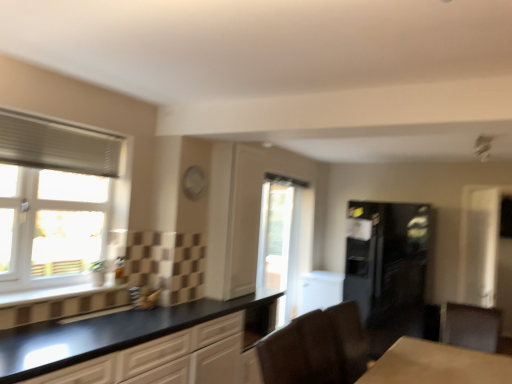
Image resolution: width=512 pixels, height=384 pixels. What do you see at coordinates (479, 244) in the screenshot?
I see `white glossy screen door at right` at bounding box center [479, 244].

You are a GUI agent. You are given a task and a screenshot of the screen. Output one action in this format:
    pyautogui.click(x=<x>, y=<y>)
    Task: Click on the matte black cabinet at lower right, which ranks as the 1th cabinetry in right-to-left order
    This screenshot has width=512, height=384.
    Given the screenshot: What is the action you would take?
    pyautogui.click(x=470, y=326)

Locate an element on the screen. The width and height of the screenshot is (512, 384). transparent glass door at center, which is the 2th window in front-to-back order is located at coordinates (284, 240).

You are a GUI agent. You are given a task and a screenshot of the screen. Output one action in this format:
    pyautogui.click(x=<x>, y=<y>)
    Task: Click on the brown leather armchair at lower center
    Image resolution: width=512 pixels, height=384 pixels.
    Given the screenshot: What is the action you would take?
    pyautogui.click(x=302, y=352)

The image size is (512, 384). In order to click on white glossy screen door at right in this screenshot , I will do `click(479, 244)`.

From the image's perspective, is black matte cabinet at lower left, which is the second cabinetry from right to left, beneath white glossy screen door at right?

Yes.

Are black matte cabinet at lower left, which is the second cabinetry from right to left, and white glossy screen door at right located far from each other?

Yes.

Could you tell me if black matte cabinet at lower left, arranged as the 1th cabinetry when viewed from the left, is turned towards white glossy screen door at right?

No, black matte cabinet at lower left, arranged as the 1th cabinetry when viewed from the left, does not turn towards white glossy screen door at right.

Measure the distance from black matte cabinet at lower left, arranged as the 1th cabinetry when viewed from the left, to white glossy screen door at right.

black matte cabinet at lower left, arranged as the 1th cabinetry when viewed from the left, is 10.02 feet away from white glossy screen door at right.

From a real-world perspective, who is located higher, transparent glass door at center, which is the 2th window in front-to-back order, or white pleated blind at upper left?

From a 3D spatial view, white pleated blind at upper left is above.

Between transparent glass door at center, acting as the 2th window starting from the left, and white pleated blind at upper left, which one has larger size?

transparent glass door at center, acting as the 2th window starting from the left, is bigger.

Is there a large distance between transparent glass door at center, the first window viewed from the right, and white pleated blind at upper left?

transparent glass door at center, the first window viewed from the right, is far away from white pleated blind at upper left.

Which is correct: transparent glass door at center, which appears as the first window when viewed from the back, is inside white pleated blind at upper left, or outside of it?

transparent glass door at center, which appears as the first window when viewed from the back, is outside white pleated blind at upper left.

From the image's perspective, which one is positioned lower, matte black cabinet at lower right, which appears as the second cabinetry when viewed from the left, or white pleated blind at upper left?

matte black cabinet at lower right, which appears as the second cabinetry when viewed from the left, is shown below in the image.

Can you confirm if matte black cabinet at lower right, which appears as the second cabinetry when viewed from the left, is smaller than white pleated blind at upper left?

Incorrect, matte black cabinet at lower right, which appears as the second cabinetry when viewed from the left, is not smaller in size than white pleated blind at upper left.

Choose the correct answer: Is matte black cabinet at lower right, which appears as the second cabinetry when viewed from the left, inside white pleated blind at upper left or outside it?

matte black cabinet at lower right, which appears as the second cabinetry when viewed from the left, is not inside white pleated blind at upper left, it's outside.

Can you confirm if matte black cabinet at lower right, which ranks as the 1th cabinetry in right-to-left order, is wider than white pleated blind at upper left?

Yes, matte black cabinet at lower right, which ranks as the 1th cabinetry in right-to-left order, is wider than white pleated blind at upper left.

The height and width of the screenshot is (384, 512). Identify the location of blind in front of the matte black cabinet at lower right, which appears as the second cabinetry when viewed from the left. (57, 146).

From the image's perspective, does white pleated blind at upper left appear lower than matte black cabinet at lower right, which ranks as the 1th cabinetry in right-to-left order?

No.

Considering the sizes of objects white pleated blind at upper left and matte black cabinet at lower right, which ranks as the 1th cabinetry in right-to-left order, in the image provided, who is wider, white pleated blind at upper left or matte black cabinet at lower right, which ranks as the 1th cabinetry in right-to-left order,?

Wider between the two is matte black cabinet at lower right, which ranks as the 1th cabinetry in right-to-left order.

Is white pleated blind at upper left aimed at matte black cabinet at lower right, which ranks as the 1th cabinetry in right-to-left order?

No, white pleated blind at upper left is not aimed at matte black cabinet at lower right, which ranks as the 1th cabinetry in right-to-left order.

Considering the points (291, 231) and (305, 360), which point is in front, point (291, 231) or point (305, 360)?

The point (305, 360) is more forward.

Is transparent glass door at center, acting as the 2th window starting from the left, wider than brown leather armchair at lower center?

In fact, transparent glass door at center, acting as the 2th window starting from the left, might be narrower than brown leather armchair at lower center.

From the image's perspective, which is above, transparent glass door at center, the first window viewed from the right, or brown leather armchair at lower center?

transparent glass door at center, the first window viewed from the right.

From a real-world perspective, is transparent glass door at center, acting as the 2th window starting from the left, positioned under brown leather armchair at lower center based on gravity?

Incorrect, from a real-world perspective, transparent glass door at center, acting as the 2th window starting from the left, is higher than brown leather armchair at lower center.

Who is more distant, white pleated blind at upper left or white glossy screen door at right?

Positioned behind is white glossy screen door at right.

From a real-world perspective, which is physically above, white pleated blind at upper left or white glossy screen door at right?

white pleated blind at upper left, from a real-world perspective.

Looking at this image, is white glossy screen door at right at the back of white pleated blind at upper left?

No, white pleated blind at upper left's orientation is not away from white glossy screen door at right.

Is white pleated blind at upper left at the right side of white glossy screen door at right?

Incorrect, white pleated blind at upper left is not on the right side of white glossy screen door at right.

Measure the distance between matte black cabinet at lower right, which ranks as the 1th cabinetry in right-to-left order, and white textured window at left, the second window in the back-to-front sequence.

A distance of 9.27 feet exists between matte black cabinet at lower right, which ranks as the 1th cabinetry in right-to-left order, and white textured window at left, the second window in the back-to-front sequence.

From a real-world perspective, between matte black cabinet at lower right, which appears as the second cabinetry when viewed from the left, and white textured window at left, the second window in the back-to-front sequence, who is vertically higher?

From a 3D spatial view, white textured window at left, the second window in the back-to-front sequence, is above.

Could you tell me if matte black cabinet at lower right, which ranks as the 1th cabinetry in right-to-left order, is facing white textured window at left, the 1th window when ordered from left to right?

No, matte black cabinet at lower right, which ranks as the 1th cabinetry in right-to-left order, is not aimed at white textured window at left, the 1th window when ordered from left to right.

Find the location of `screen door above the black matte cabinet at lower left, arranged as the 1th cabinetry when viewed from the left (from a real-world perspective)`. screen door above the black matte cabinet at lower left, arranged as the 1th cabinetry when viewed from the left (from a real-world perspective) is located at coordinates (479, 244).

This screenshot has height=384, width=512. In order to click on blind located in front of the transparent glass door at center, the first window viewed from the right in this screenshot , I will do `click(57, 146)`.

Based on their spatial positions, is black matte cabinet at lower left, arranged as the 1th cabinetry when viewed from the left, or white glossy screen door at right further from white pleated blind at upper left?

Based on the image, white glossy screen door at right appears to be further to white pleated blind at upper left.

Estimate the real-world distances between objects in this image. Which object is closer to white textured window at left, acting as the 2th window starting from the right, black glossy refrigerator at right or black matte cabinet at lower left, which is the second cabinetry from right to left?

black matte cabinet at lower left, which is the second cabinetry from right to left, is positioned closer to the anchor white textured window at left, acting as the 2th window starting from the right.

In the scene shown: Which object lies nearer to the anchor point black matte cabinet at lower left, which is the second cabinetry from right to left, matte black cabinet at lower right, which ranks as the 1th cabinetry in right-to-left order, or white glossy screen door at right?

matte black cabinet at lower right, which ranks as the 1th cabinetry in right-to-left order, is positioned closer to the anchor black matte cabinet at lower left, which is the second cabinetry from right to left.

When comparing their distances from white pleated blind at upper left, does white glossy screen door at right or white textured window at left, the second window in the back-to-front sequence, seem further?

white glossy screen door at right is further to white pleated blind at upper left.

When comparing their distances from white glossy screen door at right, does transparent glass door at center, the first window viewed from the right, or matte black cabinet at lower right, which ranks as the 1th cabinetry in right-to-left order, seem closer?

Among the two, matte black cabinet at lower right, which ranks as the 1th cabinetry in right-to-left order, is located nearer to white glossy screen door at right.

Based on the photo, which object lies nearer to the anchor point white glossy screen door at right, matte black cabinet at lower right, which ranks as the 1th cabinetry in right-to-left order, or brown leather armchair at lower center?

Based on the image, matte black cabinet at lower right, which ranks as the 1th cabinetry in right-to-left order, appears to be nearer to white glossy screen door at right.

From the picture: Looking at the image, which one is located further to transparent glass door at center, which appears as the first window when viewed from the back, matte black cabinet at lower right, which ranks as the 1th cabinetry in right-to-left order, or white textured window at left, acting as the 2th window starting from the right?

white textured window at left, acting as the 2th window starting from the right, is further to transparent glass door at center, which appears as the first window when viewed from the back.

Which object lies further to the anchor point brown leather armchair at lower center, transparent glass door at center, which is the 2th window in front-to-back order, or black matte cabinet at lower left, arranged as the 1th cabinetry when viewed from the left?

Among the two, transparent glass door at center, which is the 2th window in front-to-back order, is located further to brown leather armchair at lower center.

This screenshot has height=384, width=512. Identify the location of cabinetry between brown leather armchair at lower center and black glossy refrigerator at right from front to back. (470, 326).

Identify the location of cabinetry located between black matte cabinet at lower left, arranged as the 1th cabinetry when viewed from the left, and transparent glass door at center, which appears as the first window when viewed from the back, in the depth direction. This screenshot has height=384, width=512. (470, 326).

This screenshot has width=512, height=384. Identify the location of cabinetry between black matte cabinet at lower left, which is the second cabinetry from right to left, and black glossy refrigerator at right in the front-back direction. (470, 326).

Identify the location of armchair located between black matte cabinet at lower left, which is the second cabinetry from right to left, and white glossy screen door at right in the left-right direction. (302, 352).